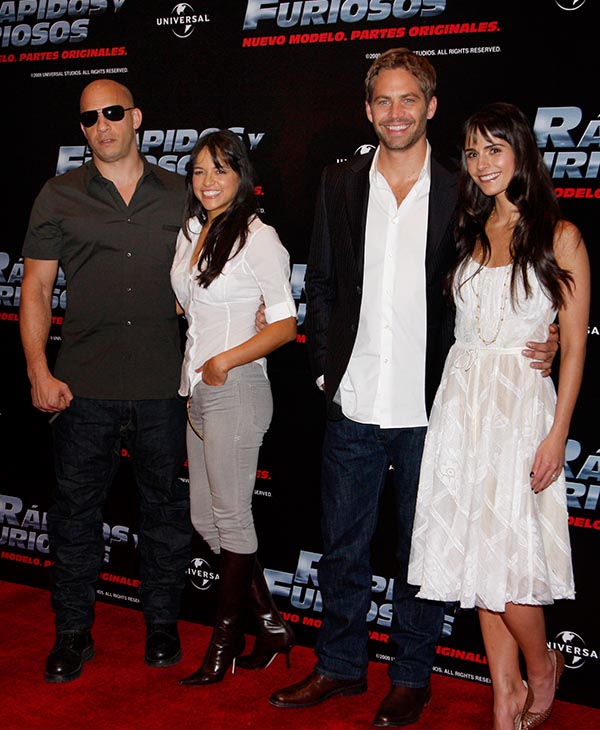
Locate an element on the screen. Image resolution: width=600 pixels, height=730 pixels. carpet is located at coordinates (195, 693).